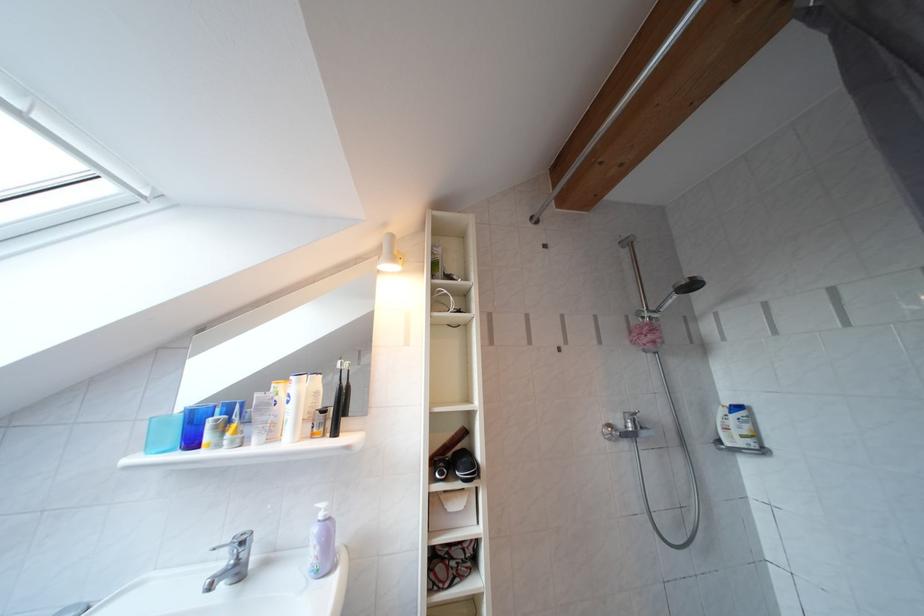
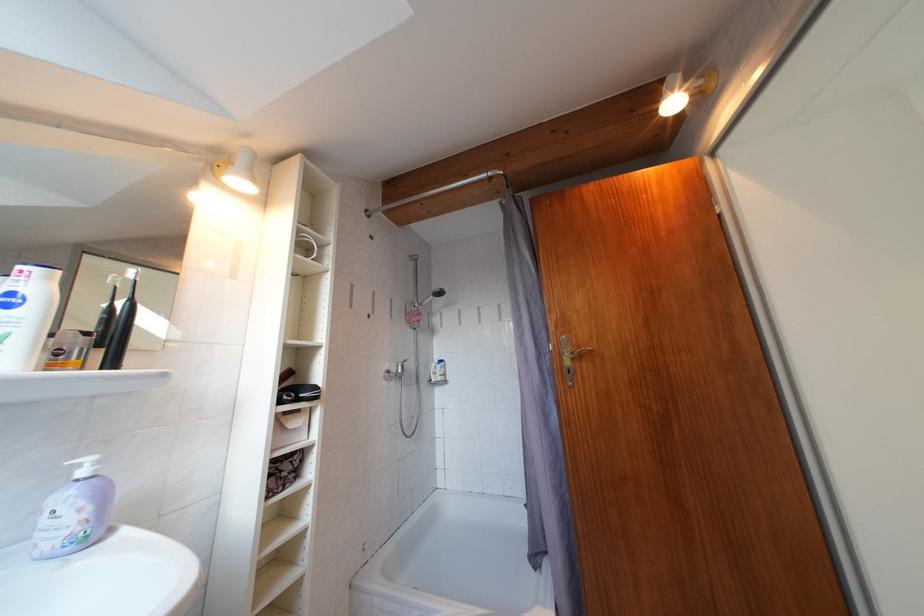
Question: I am providing you with two images of the same scene from different viewpoints. Which of the following objects are not visible in image2?

Choices:
 (A) white lotion bottle
 (B) handheld shower head
 (C) pink shower sponge
 (D) none of these

Answer: (D)